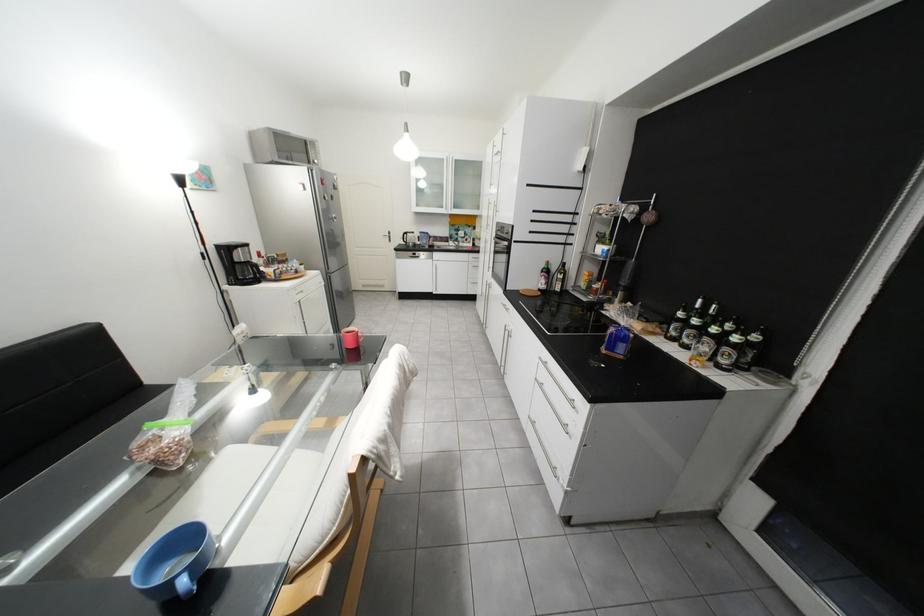
The width and height of the screenshot is (924, 616). Identify the location of chair sitting surface. (294, 427).